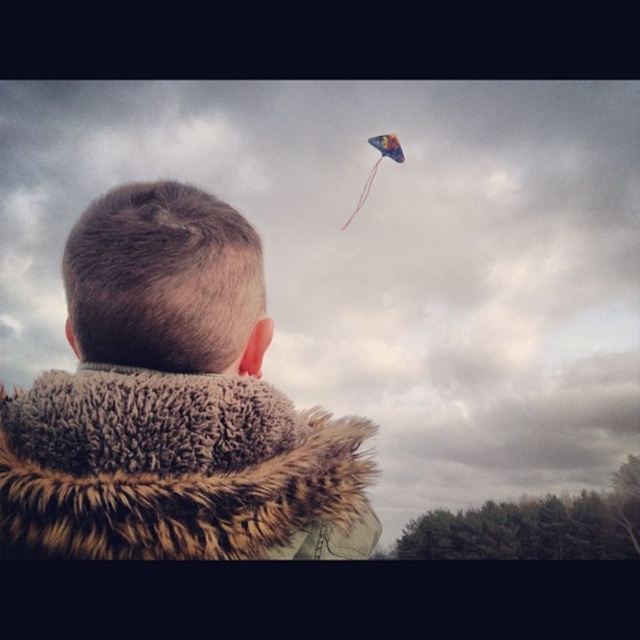
Is fuzzy brown coat at upper center to the right of multicolored paper kite at upper center from the viewer's perspective?

Incorrect, fuzzy brown coat at upper center is not on the right side of multicolored paper kite at upper center.

Can you confirm if fuzzy brown coat at upper center is smaller than multicolored paper kite at upper center?

Yes, fuzzy brown coat at upper center is smaller than multicolored paper kite at upper center.

This screenshot has width=640, height=640. Describe the element at coordinates (173, 404) in the screenshot. I see `fuzzy brown coat at upper center` at that location.

I want to click on fuzzy brown coat at upper center, so click(173, 404).